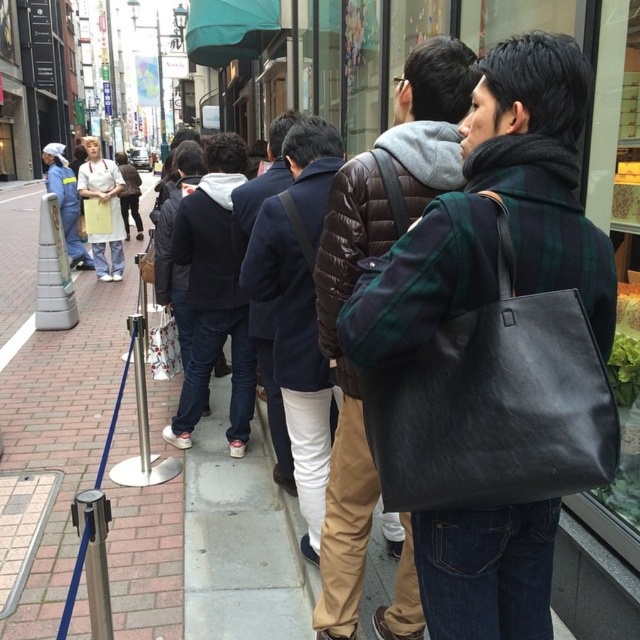
Does green plaid coat at center have a smaller size compared to matte black bag at center?

Yes, green plaid coat at center is smaller than matte black bag at center.

Is green plaid coat at center behind matte black bag at center?

No, it is in front of matte black bag at center.

This screenshot has width=640, height=640. What do you see at coordinates (540, 168) in the screenshot? I see `green plaid coat at center` at bounding box center [540, 168].

I want to click on green plaid coat at center, so click(x=540, y=168).

Which of these two, matte black bag at center or dark blue wool coat at center, stands shorter?

dark blue wool coat at center

Between matte black bag at center and dark blue wool coat at center, which one is positioned lower?

Positioned lower is matte black bag at center.

Between point (333, 248) and point (298, 404), which one is positioned behind?

Point (298, 404)

Find the location of a particular element. matte black bag at center is located at coordinates (356, 280).

Between point (445, 634) and point (308, 529), which one is positioned behind?

Positioned behind is point (308, 529).

Can you confirm if green plaid coat at center is thinner than dark blue wool coat at center?

No, green plaid coat at center is not thinner than dark blue wool coat at center.

Is point (522, 577) in front of point (316, 403)?

Yes.

You are a GUI agent. You are given a task and a screenshot of the screen. Output one action in this format:
    pyautogui.click(x=<x>, y=<y>)
    Task: Click on the green plaid coat at center
    
    Given the screenshot: What is the action you would take?
    pyautogui.click(x=540, y=168)